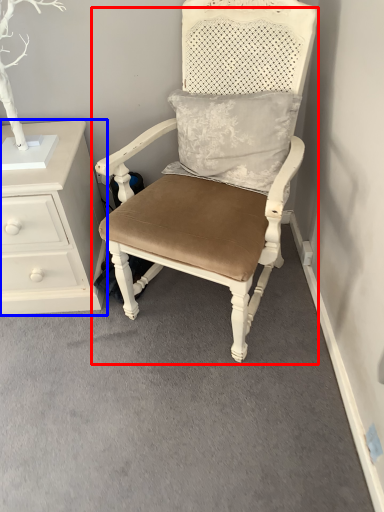
Question: Which object is closer to the camera taking this photo, chair (highlighted by a red box) or chest of drawers (highlighted by a blue box)?

Choices:
 (A) chair
 (B) chest of drawers

Answer: (A)